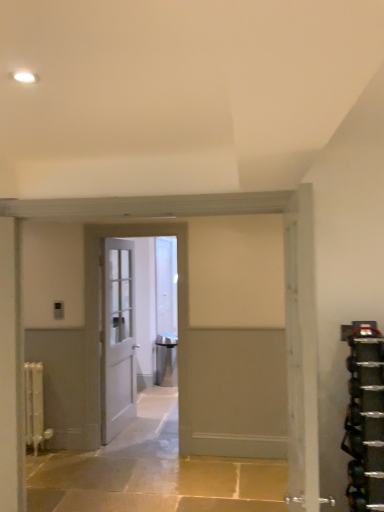
How much space does white wooden door at center, which appears as the second door when viewed from the front, occupy horizontally?

The width of white wooden door at center, which appears as the second door when viewed from the front, is 11.23 centimeters.

You are a GUI agent. You are given a task and a screenshot of the screen. Output one action in this format:
    pyautogui.click(x=<x>, y=<y>)
    Task: Click on the white matte radiator at left
    
    Given the screenshot: What is the action you would take?
    pyautogui.click(x=35, y=407)

In order to face white wooden door at center, the 2th door when ordered from back to front, should I rotate leftwards or rightwards?

Rotate your view left by about 10.018°.

This screenshot has height=512, width=384. In order to click on white glossy door at center, the 4th door viewed from the front in this screenshot , I will do `click(166, 312)`.

This screenshot has width=384, height=512. What are the coordinates of `metallic silver weights at right` in the screenshot? It's located at (365, 419).

You are a GUI agent. You are given a task and a screenshot of the screen. Output one action in this format:
    pyautogui.click(x=<x>, y=<y>)
    Task: Click on the white painted wood door at center, acting as the fourth door starting from the back
    The height and width of the screenshot is (512, 384).
    Given the screenshot: What is the action you would take?
    pyautogui.click(x=302, y=354)

Choose the correct answer: Is white painted wood door at center, which is the first door from right to left, inside satin silver trash can at center or outside it?

white painted wood door at center, which is the first door from right to left, is outside satin silver trash can at center.

Who is smaller, white painted wood door at center, acting as the 4th door starting from the left, or satin silver trash can at center?

satin silver trash can at center is smaller.

Does white painted wood door at center, the first door viewed from the front, have a greater width compared to satin silver trash can at center?

Incorrect, the width of white painted wood door at center, the first door viewed from the front, does not surpass that of satin silver trash can at center.

From the picture: Does satin silver trash can at center touch metallic silver weights at right?

satin silver trash can at center and metallic silver weights at right are not in contact.

Is satin silver trash can at center wider than metallic silver weights at right?

Incorrect, the width of satin silver trash can at center does not surpass that of metallic silver weights at right.

Considering the relative sizes of satin silver trash can at center and metallic silver weights at right in the image provided, is satin silver trash can at center bigger than metallic silver weights at right?

No, satin silver trash can at center is not bigger than metallic silver weights at right.

Between satin silver trash can at center and metallic silver weights at right, which one appears on the left side from the viewer's perspective?

satin silver trash can at center.

This screenshot has height=512, width=384. Identify the location of shelf below the white glossy door at center, the 4th door viewed from the front (from the image's perspective). (365, 419).

Can you confirm if white glossy door at center, which is counted as the 3th door, starting from the left, is taller than metallic silver weights at right?

Correct, white glossy door at center, which is counted as the 3th door, starting from the left, is much taller as metallic silver weights at right.

Between point (159, 381) and point (357, 499), which one is positioned behind?

The point (159, 381) is farther from the camera.

Does white glossy door at center, the 4th door viewed from the front, have a greater width compared to metallic silver weights at right?

No.

Is point (170, 320) positioned before point (299, 451)?

No, it is not.

Between white glossy door at center, the 4th door viewed from the front, and white painted wood door at center, the first door viewed from the front, which one is positioned in front?

white painted wood door at center, the first door viewed from the front.

Can you confirm if white glossy door at center, which is the 1th door in back-to-front order, is thinner than white painted wood door at center, the first door viewed from the front?

Yes, white glossy door at center, which is the 1th door in back-to-front order, is thinner than white painted wood door at center, the first door viewed from the front.

At what (x,y) coordinates should I click in order to perform the action: click on the 3rd door in front of the white glossy door at center, which is counted as the 3th door, starting from the left, counting from the anchor's position. Please return your answer as a coordinate pair (x, y). Looking at the image, I should click on (302, 354).

You are a GUI agent. You are given a task and a screenshot of the screen. Output one action in this format:
    pyautogui.click(x=<x>, y=<y>)
    Task: Click on the shelf that appears on the right of white wooden door at center, acting as the second door starting from the left
    
    Given the screenshot: What is the action you would take?
    pyautogui.click(x=365, y=419)

Is metallic silver weights at right taller or shorter than white wooden door at center, which appears as the second door when viewed from the front?

In the image, metallic silver weights at right appears to be shorter than white wooden door at center, which appears as the second door when viewed from the front.

Is point (372, 333) behind point (92, 346)?

No, (372, 333) is closer to viewer.

From a real-world perspective, between metallic silver weights at right and white wooden door at center, which ranks as the third door in right-to-left order, who is vertically higher?

white wooden door at center, which ranks as the third door in right-to-left order, from a real-world perspective.

Which of these two, white matte radiator at left or white painted wood door at center, acting as the fourth door starting from the back, is thinner?

With smaller width is white matte radiator at left.

Based on the photo, between white matte radiator at left and white painted wood door at center, acting as the 4th door starting from the left, which one has less height?

white matte radiator at left.

Is white matte radiator at left in contact with white painted wood door at center, which is the first door from right to left?

No, white matte radiator at left is not in contact with white painted wood door at center, which is the first door from right to left.

From the image's perspective, is white matte radiator at left located above or below white painted wood door at center, the first door viewed from the front?

Based on their image positions, white matte radiator at left is located beneath white painted wood door at center, the first door viewed from the front.

Could you tell me if white wooden door at center, which ranks as the fourth door in right-to-left order, is facing satin silver trash can at center?

No, white wooden door at center, which ranks as the fourth door in right-to-left order, does not turn towards satin silver trash can at center.

Does point (124, 378) lie behind point (165, 369)?

No, it is in front of (165, 369).

Is white wooden door at center, acting as the 3th door starting from the front, not inside satin silver trash can at center?

white wooden door at center, acting as the 3th door starting from the front, lies outside satin silver trash can at center's area.

From the image's perspective, does white wooden door at center, which ranks as the fourth door in right-to-left order, appear higher than satin silver trash can at center?

Yes.

At what (x,y) coordinates should I click in order to perform the action: click on furniture on the left of the white painted wood door at center, the first door viewed from the front. Please return your answer as a coordinate pair (x, y). Looking at the image, I should click on (166, 360).

This screenshot has height=512, width=384. In the image, there is a satin silver trash can at center. In order to click on shelf above it (from the image's perspective) in this screenshot , I will do `click(365, 419)`.

Looking at the image, which one is located further to white matte radiator at left, white wooden door at center, the 2th door when ordered from back to front, or satin silver trash can at center?

satin silver trash can at center is further to white matte radiator at left.

When comparing their distances from white matte radiator at left, does satin silver trash can at center or metallic silver weights at right seem closer?

satin silver trash can at center is closer to white matte radiator at left.

From the image, which object appears to be nearer to white glossy door at center, the 4th door viewed from the front, white painted wood door at center, acting as the fourth door starting from the back, or metallic silver weights at right?

The object closer to white glossy door at center, the 4th door viewed from the front, is metallic silver weights at right.

When comparing their distances from white wooden door at center, acting as the second door starting from the left, does white glossy door at center, which is counted as the 3th door, starting from the left, or white painted wood door at center, the first door viewed from the front, seem further?

white painted wood door at center, the first door viewed from the front, is further to white wooden door at center, acting as the second door starting from the left.

Looking at the image, which one is located closer to white wooden door at center, acting as the 3th door starting from the front, white matte radiator at left or white wooden door at center, acting as the second door starting from the left?

white wooden door at center, acting as the second door starting from the left, is closer to white wooden door at center, acting as the 3th door starting from the front.

Which object lies further to the anchor point satin silver trash can at center, white painted wood door at center, acting as the fourth door starting from the back, or white glossy door at center, which is the 2th door in right-to-left order?

white painted wood door at center, acting as the fourth door starting from the back, is further to satin silver trash can at center.

Estimate the real-world distances between objects in this image. Which object is further from satin silver trash can at center, white wooden door at center, which ranks as the third door in right-to-left order, or white painted wood door at center, the first door viewed from the front?

white painted wood door at center, the first door viewed from the front, lies further to satin silver trash can at center than the other object.

Considering their positions, is white glossy door at center, the 4th door viewed from the front, positioned further to satin silver trash can at center than white matte radiator at left?

Based on the image, white matte radiator at left appears to be further to satin silver trash can at center.

The image size is (384, 512). In order to click on radiator between white painted wood door at center, which is the first door from right to left, and white wooden door at center, which appears as the second door when viewed from the front, from front to back in this screenshot , I will do `click(35, 407)`.

Identify the location of radiator between metallic silver weights at right and satin silver trash can at center from front to back. [35, 407].

Where is `radiator between metallic silver weights at right and white wooden door at center, the 2th door when ordered from back to front, along the z-axis`? radiator between metallic silver weights at right and white wooden door at center, the 2th door when ordered from back to front, along the z-axis is located at coordinates (35, 407).

This screenshot has height=512, width=384. I want to click on shelf located between white painted wood door at center, acting as the 4th door starting from the left, and white glossy door at center, the 4th door viewed from the front, in the depth direction, so click(365, 419).